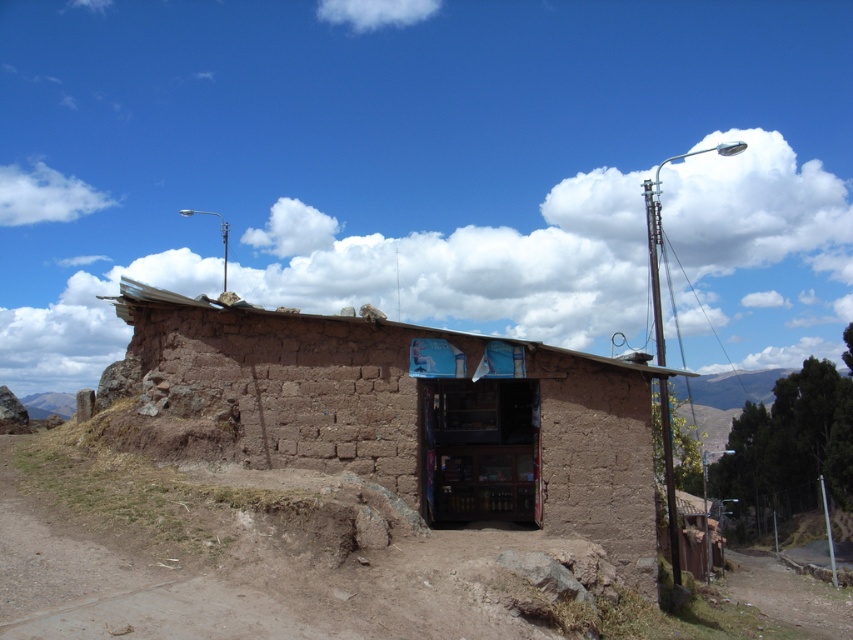
You are standing in front of the rustic building and want to walk towards the brown dirt track at center and the metallic pole at right. Which object will you encounter first?

The brown dirt track at center is closer to the viewer than the metallic pole at right, so you will encounter the brown dirt track at center first.

You are standing in front of the brown mud hut at center and want to walk to the brown dirt track at center. Which direction should you move relative to the building?

Since the brown mud hut at center is closer to you than the brown dirt track at center, you should move away from the building to reach the brown dirt track at center.